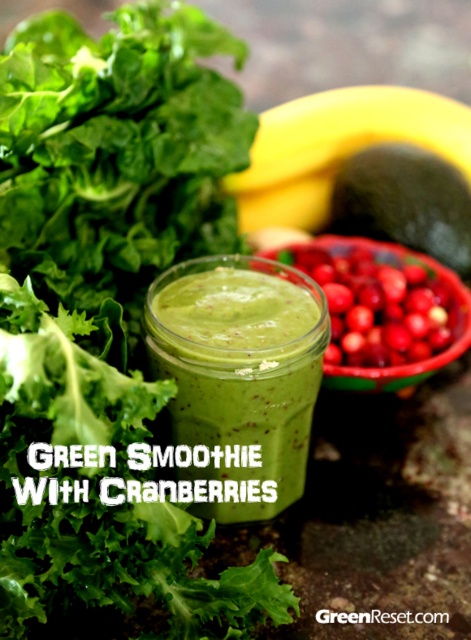
Question: Which point is closer to the camera?

Choices:
 (A) green matte avocado at center right
 (B) red matte cranberries at center

Answer: (B)

Question: Which point is farther to the camera?

Choices:
 (A) yellow matte banana at upper center
 (B) green matte avocado at center right
 (C) red matte cranberries at center
 (D) green matte smoothie at center

Answer: (B)

Question: Which point is closer to the camera?

Choices:
 (A) yellow matte banana at upper center
 (B) red matte cranberries at center

Answer: (B)

Question: In this image, where is red matte cranberries at center located relative to green matte avocado at center right?

Choices:
 (A) right
 (B) left

Answer: (B)

Question: Does green matte smoothie at center have a larger size compared to red matte cranberries at center?

Choices:
 (A) yes
 (B) no

Answer: (B)

Question: Does green matte smoothie at center lie in front of green matte avocado at center right?

Choices:
 (A) yes
 (B) no

Answer: (A)